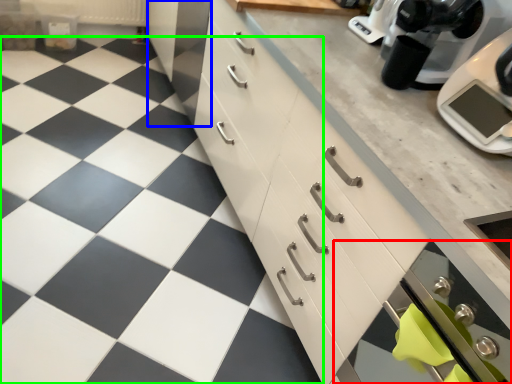
Question: Which is nearer to the oven (highlighted by a red box)? cabinetry (highlighted by a blue box) or tile (highlighted by a green box).

Choices:
 (A) cabinetry
 (B) tile

Answer: (B)